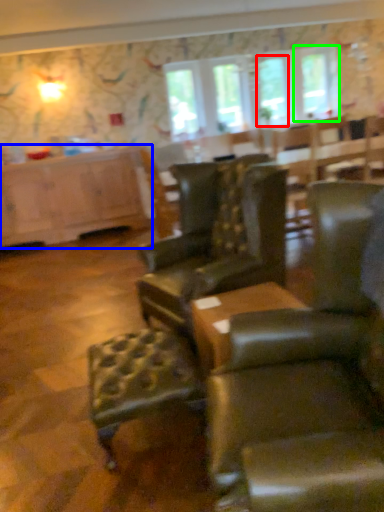
Question: Which object is the farthest from window screen (highlighted by a red box)? Choose among these: cabinetry (highlighted by a blue box) or window (highlighted by a green box).

Choices:
 (A) cabinetry
 (B) window

Answer: (A)